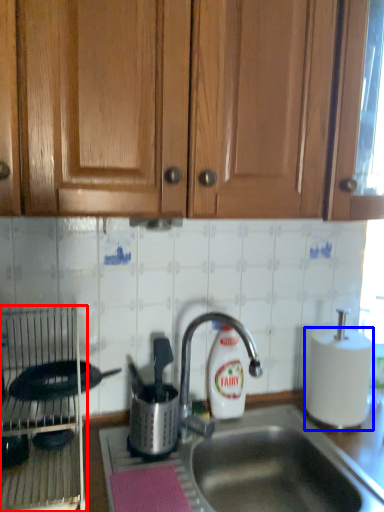
Question: Which object is closer to the camera taking this photo, appliance (highlighted by a red box) or paper towel (highlighted by a blue box)?

Choices:
 (A) appliance
 (B) paper towel

Answer: (A)